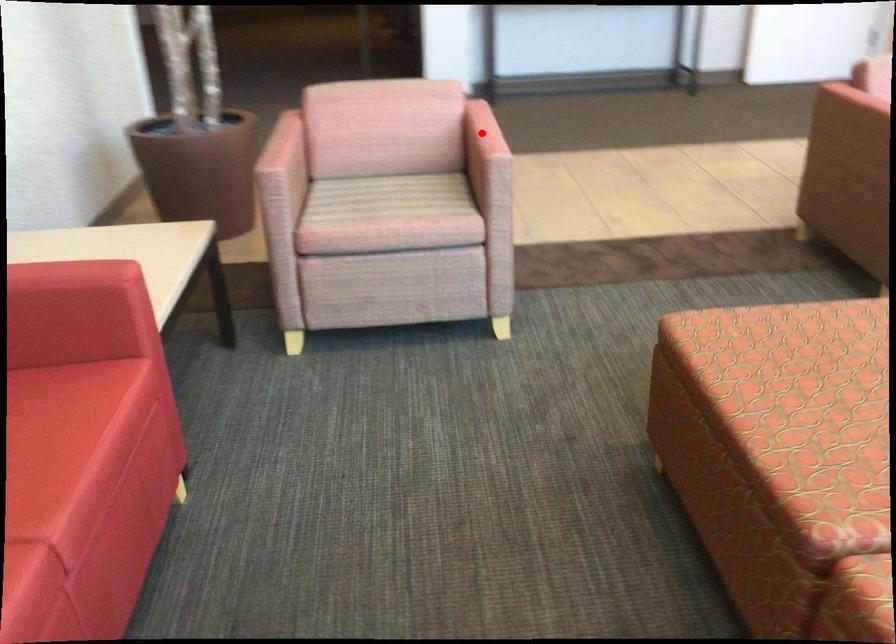
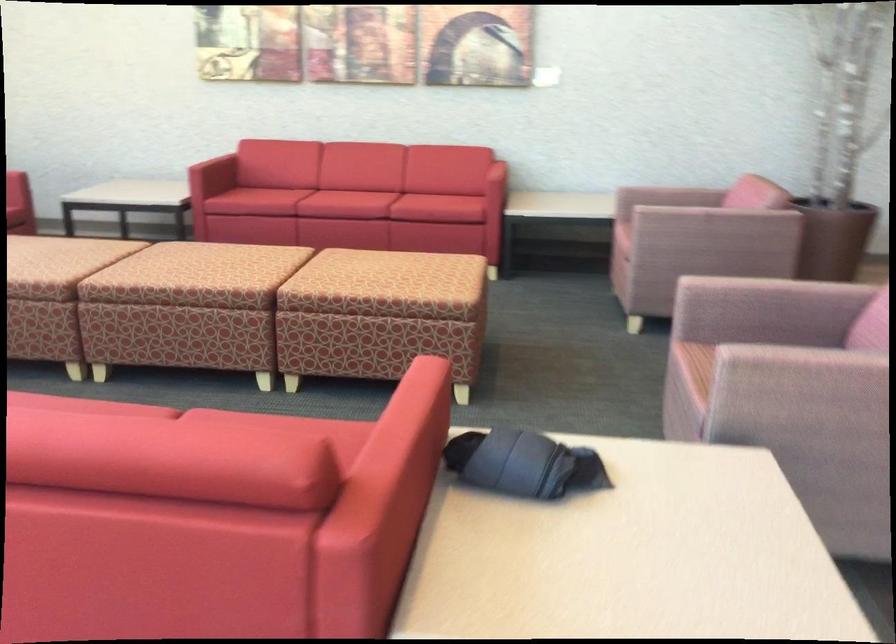
Question: I am providing you with two images of the same scene from different viewpoints. A red point is marked on the first image. Is the red point's position out of view in image 2?

Choices:
 (A) Yes
 (B) No

Answer: (A)